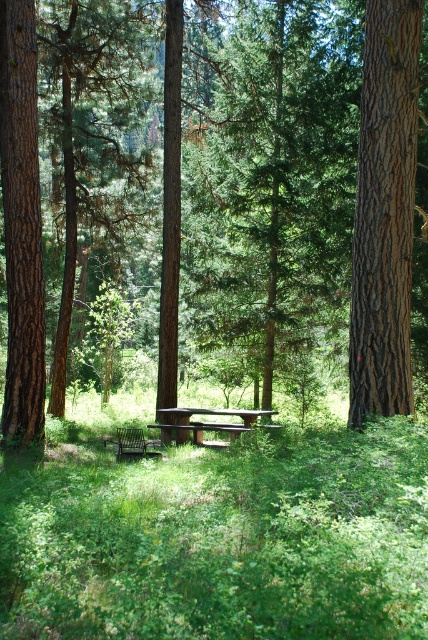
You are planning to take a photo of the green textured tree at center and the smooth brown tree trunk at left. Which tree is wider in the image?

The green textured tree at center is wider than the smooth brown tree trunk at left.

You are standing at the picnic table and want to walk towards the point labeled as point (407,317). Is the point labeled point (246,129) located behind or in front of your path?

The point labeled point (246,129) is behind point labeled point (407,317), so it would be behind your path as you walk towards point (407,317).

In the scene shown: You are planning to place a small picnic basket between the brown rough tree at center and the smooth brown tree trunk at right. Based on their positions, which tree should the basket be closer to?

The brown rough tree at center is positioned over the smooth brown tree trunk at right, so the basket should be placed closer to the brown rough tree at center to ensure it is above the trunk.